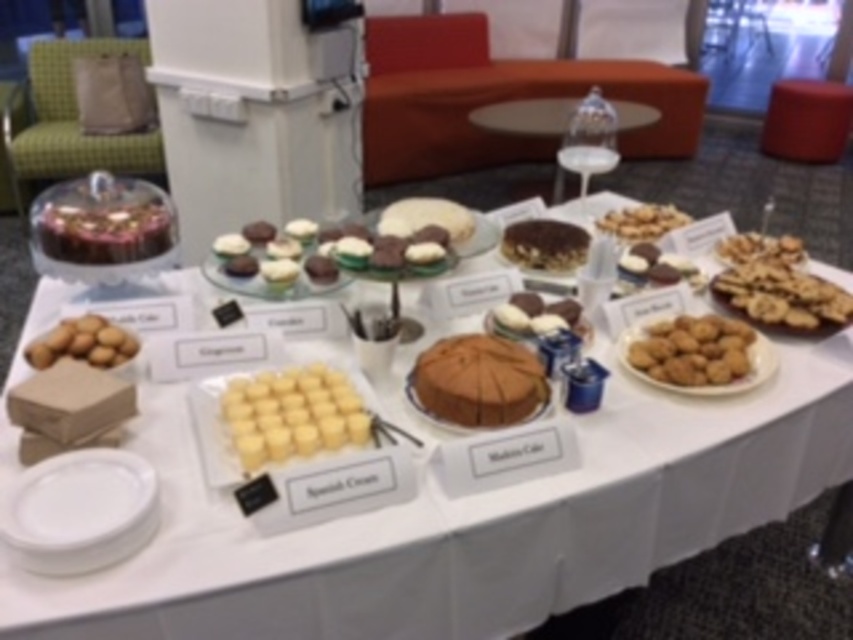
Who is more forward, (457, 410) or (688, 349)?

Positioned in front is point (457, 410).

Which is behind, point (442, 369) or point (724, 355)?

Positioned behind is point (724, 355).

The height and width of the screenshot is (640, 853). I want to click on brown matte cake at center, so click(479, 380).

The height and width of the screenshot is (640, 853). Find the location of `brown matte cake at center`. brown matte cake at center is located at coordinates (479, 380).

Does point (183, 561) lie behind point (737, 332)?

No, (183, 561) is in front of (737, 332).

Which is above, matte brown cake at center or golden brown crumbly cookies at right?

Positioned higher is golden brown crumbly cookies at right.

Locate an element on the screen. matte brown cake at center is located at coordinates (492, 520).

Is white matte plate at lower left wider than white chocolate-covered cookies at center?

Indeed, white matte plate at lower left has a greater width compared to white chocolate-covered cookies at center.

You are a GUI agent. You are given a task and a screenshot of the screen. Output one action in this format:
    pyautogui.click(x=<x>, y=<y>)
    Task: Click on the white matte plate at lower left
    The image size is (853, 640).
    Given the screenshot: What is the action you would take?
    pyautogui.click(x=80, y=502)

The width and height of the screenshot is (853, 640). In order to click on white matte plate at lower left in this screenshot , I will do `click(80, 502)`.

Find the location of a particular element. white matte plate at lower left is located at coordinates (80, 502).